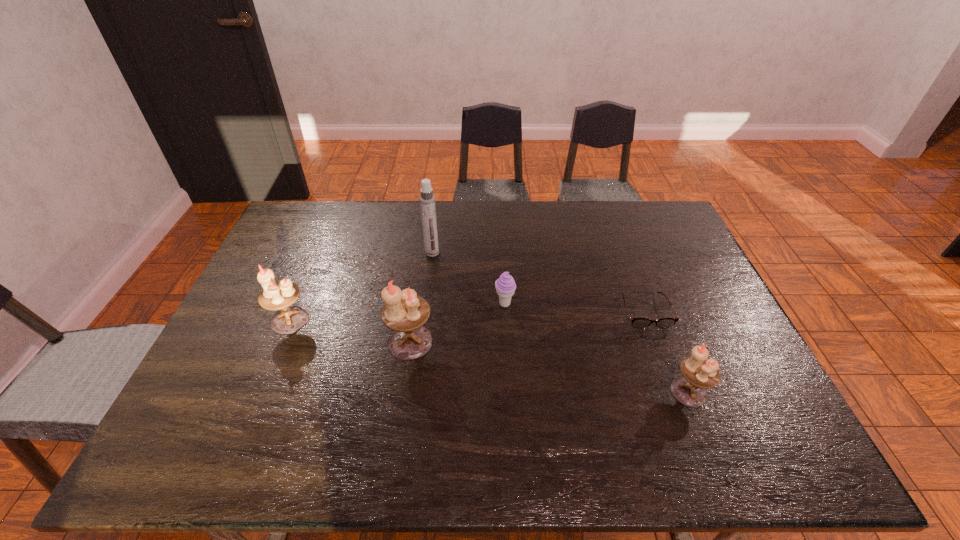
If the aim is uniform spacing by inserting an additional candle_holder among them, please point to a vacant space for this new candle_holder. Please provide its 2D coordinates. Your answer should be formatted as a tuple, i.e. [(x, y)], where the tuple contains the x and y coordinates of a point satisfying the conditions above.

[(542, 366)]